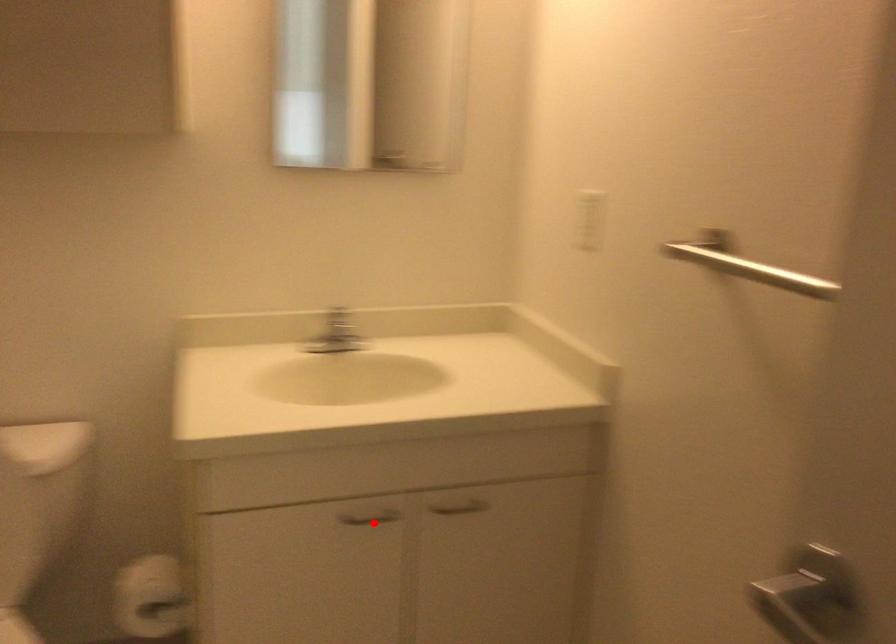
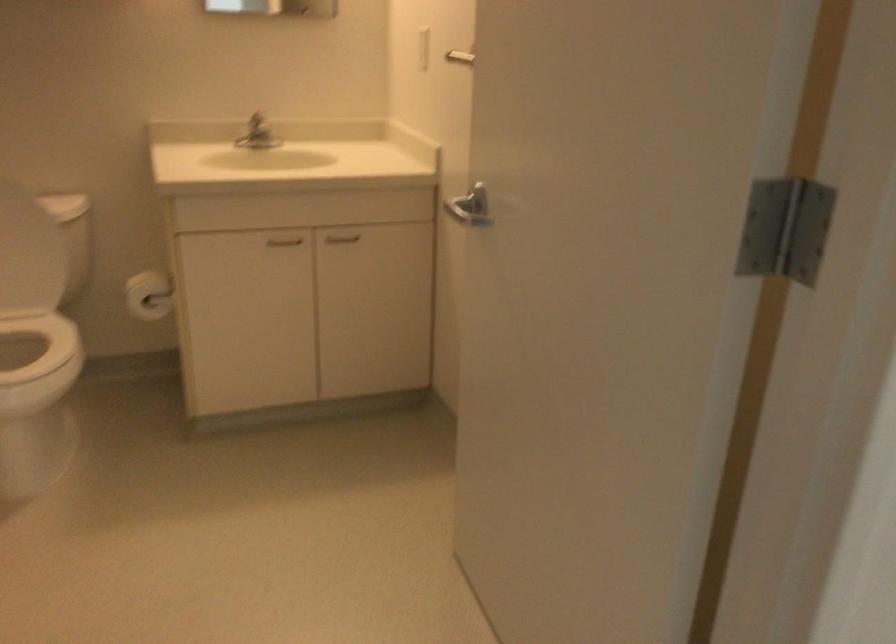
Question: I am providing you with two images of the same scene from different viewpoints. Given a red point in image1, look at the same physical point in image2. Is it:

Choices:
 (A) Closer to the viewpoint
 (B) Farther from the viewpoint

Answer: (B)